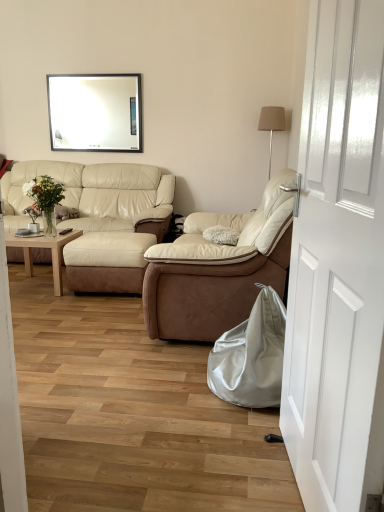
Identify the location of vacant area on the back side of white glossy door at center. (230, 426).